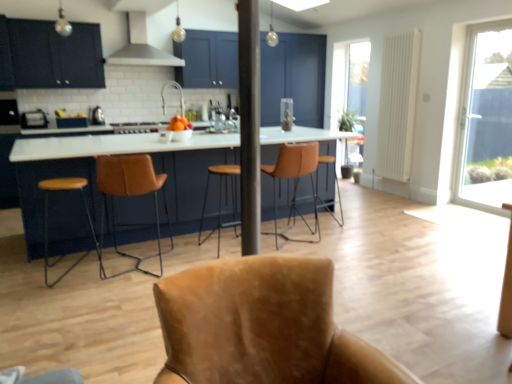
Find the location of `vacant region below leather bar stool at center, which is the 4th chair from front to back (from a real-world perspective)`. vacant region below leather bar stool at center, which is the 4th chair from front to back (from a real-world perspective) is located at coordinates (288, 234).